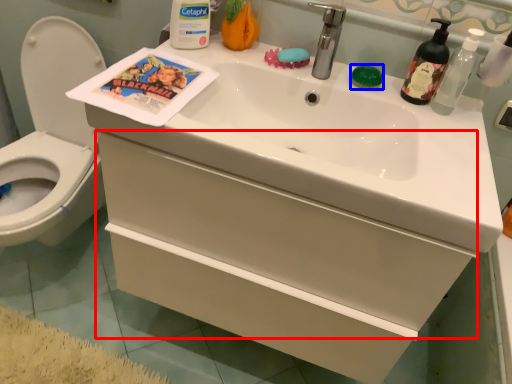
Question: Among these objects, which one is nearest to the camera, drawer (highlighted by a red box) or soap (highlighted by a blue box)?

Choices:
 (A) drawer
 (B) soap

Answer: (A)